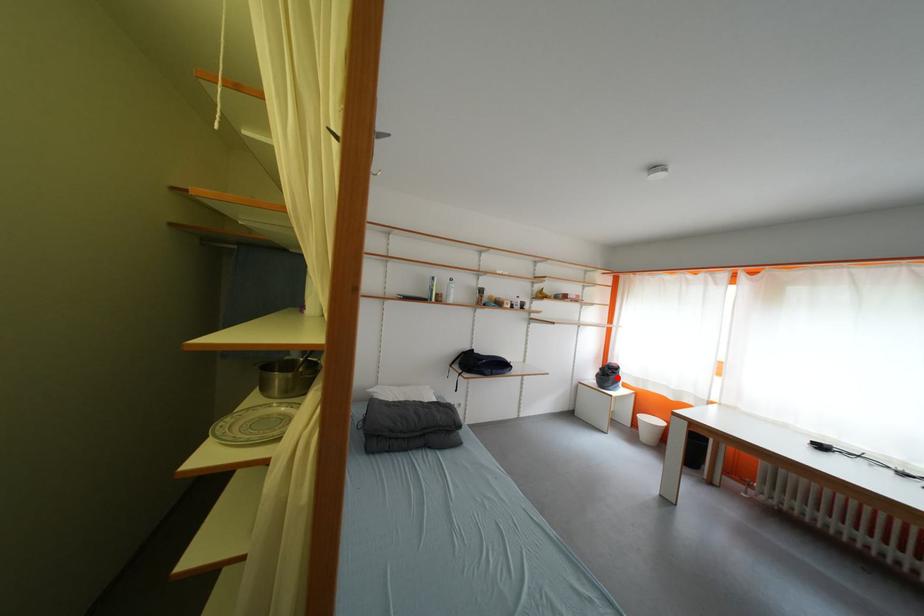
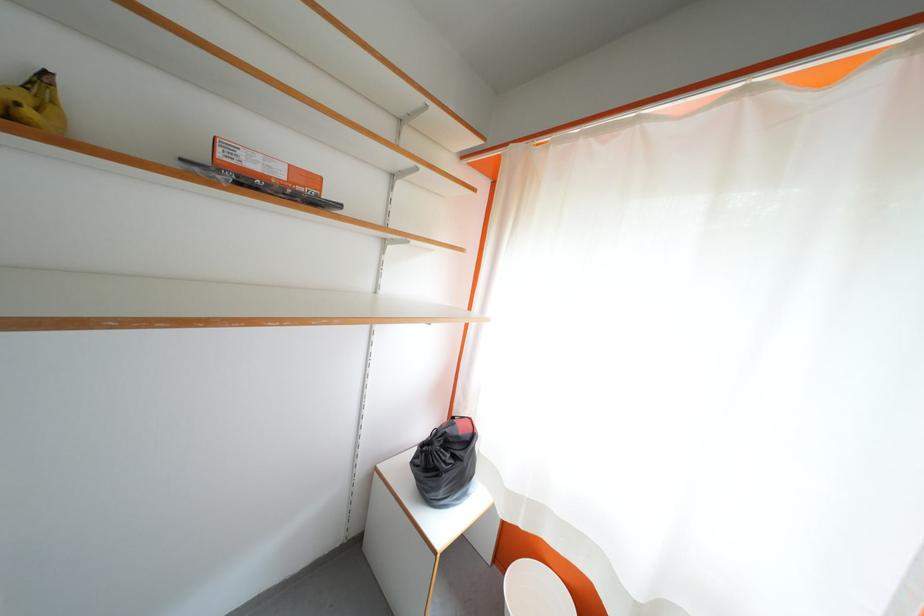
Question: A red point is marked in image1. In image2, is the corresponding 3D point closer to the camera or farther? Reply with the corresponding letter.

Choices:
 (A) The corresponding 3D point is closer.
 (B) The corresponding 3D point is farther.

Answer: (B)